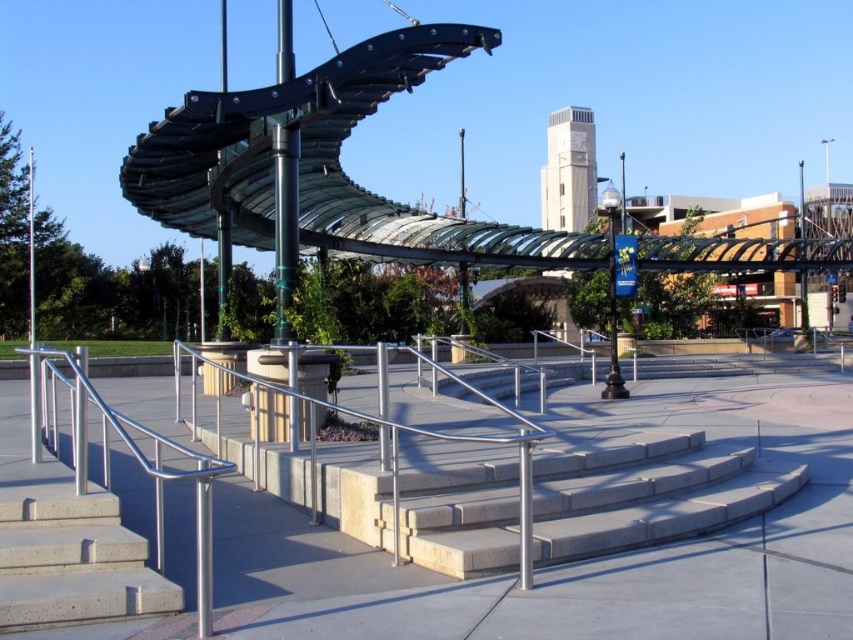
Question: Is concrete/steps at lower left thinner than stainless steel handrail at lower left?

Choices:
 (A) yes
 (B) no

Answer: (B)

Question: Which point is farther to the camera?

Choices:
 (A) light gray concrete stairs at center
 (B) stainless steel handrail at lower left
 (C) metallic glass canopy at center
 (D) concrete/steps at lower left

Answer: (C)

Question: Estimate the real-world distances between objects in this image. Which object is farther from the metallic glass canopy at center?

Choices:
 (A) stainless steel handrail at lower left
 (B) concrete/steps at lower left
 (C) light gray concrete stairs at center

Answer: (A)

Question: Is stainless steel handrail at lower left below metallic glass canopy at center?

Choices:
 (A) no
 (B) yes

Answer: (B)

Question: Among these points, which one is nearest to the camera?

Choices:
 (A) (669, 196)
 (B) (0, 618)

Answer: (B)

Question: Does light gray concrete stairs at center have a lesser width compared to metallic glass canopy at center?

Choices:
 (A) yes
 (B) no

Answer: (A)